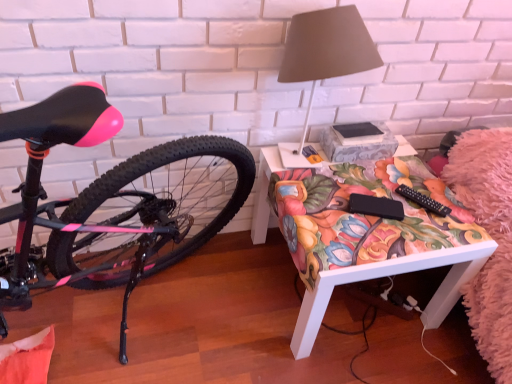
This screenshot has height=384, width=512. In order to click on free space in front of black plastic remote control at lower right in this screenshot , I will do `click(422, 234)`.